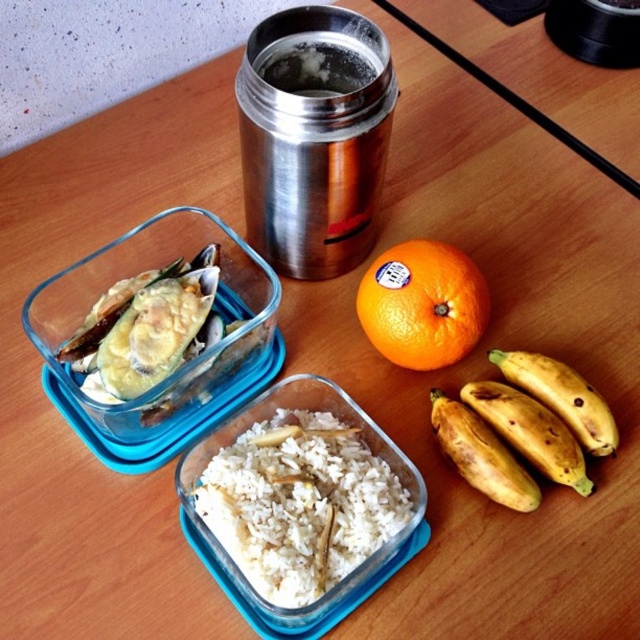
You are a delivery robot that needs to pick up the orangesmoothobject at center. The robot has a maximum reach of 25 inches. Can you reach it?

The orangesmoothobject at center is 27.08 inches away from the camera, which is beyond the robot s 25 inch reach. The robot cannot reach it.

You are arranging fruits on a table and need to place the brown spotted bananas at lower right and the orangesmoothobject at center. According to the spatial arrangement, which fruit is closer to you?

The orangesmoothobject at center is closer to you because the brown spotted bananas at lower right is behind it.